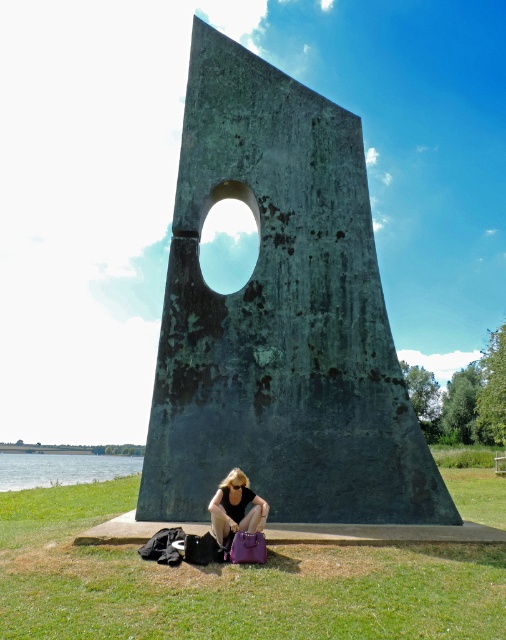
You are standing at the center of the grassy area and want to take a photo of the green patina stone sculpture at center. If you move 0.1 units north, will you be closer to the sculpture?

The green patina stone sculpture at center is located at point (279,317). Moving 0.1 units north would adjust your position, but since the sculpture is already at the center, moving north might not necessarily bring you closer. However, without knowing your starting position, it is impossible to determine.

You are standing at the base of the sculpture and want to find the green water. Which direction should you look to see the point at coordinates [62,468]?

The point at coordinates [62,468] corresponds to the green water at lower left, so you should look towards the lower left direction to see it.

You are a photographer wanting to capture the green patina stone sculpture at center and the matte purple handbag at lower center in the same frame. Based on their sizes, which object should you focus on first to ensure both are visible in the shot?

The green patina stone sculpture at center is shorter than the matte purple handbag at lower center, so you should focus on the taller matte purple handbag at lower center first to ensure both are visible in the shot.